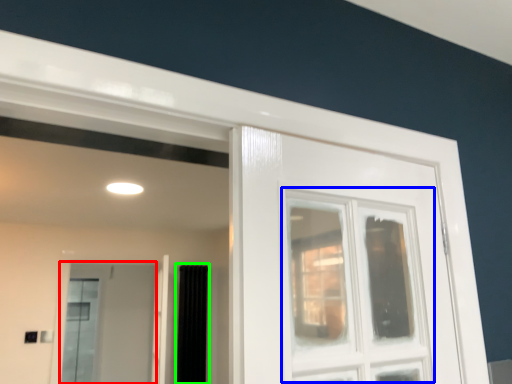
Question: Which is farther away from screen door (highlighted by a red box)? window (highlighted by a blue box) or curtain (highlighted by a green box)?

Choices:
 (A) window
 (B) curtain

Answer: (A)